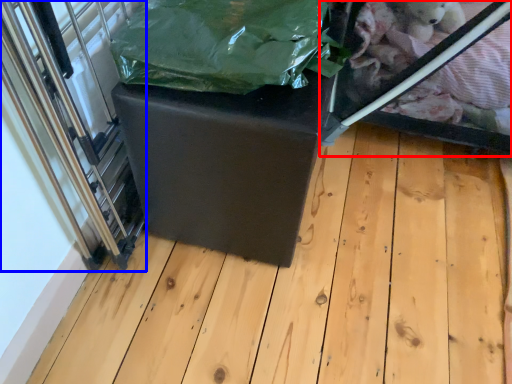
Question: Which of the following is the farthest to the observer, glass box (highlighted by a red box) or glass door (highlighted by a blue box)?

Choices:
 (A) glass box
 (B) glass door

Answer: (A)